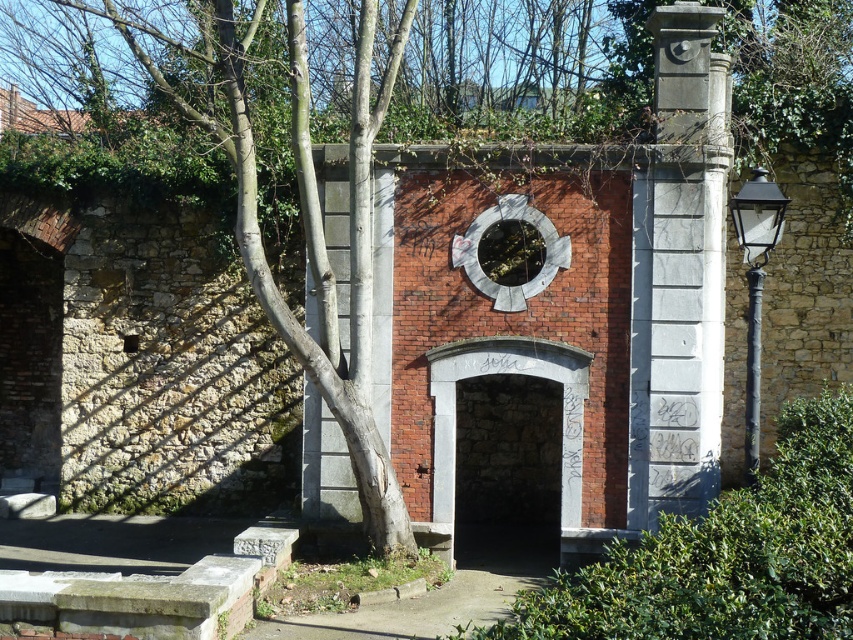
Question: Which of the following is the closest to the observer?

Choices:
 (A) (703, 305)
 (B) (503, 451)

Answer: (A)

Question: Does green leafy ivy at center appear on the left side of stone archway at center?

Choices:
 (A) no
 (B) yes

Answer: (A)

Question: Which object appears closest to the camera in this image?

Choices:
 (A) gray marble column at right
 (B) stone archway at center

Answer: (A)

Question: Does gray marble column at right appear over stone archway at center?

Choices:
 (A) no
 (B) yes

Answer: (B)

Question: Estimate the real-world distances between objects in this image. Which object is farther from the gray marble column at right?

Choices:
 (A) stone archway at center
 (B) green leafy ivy at center

Answer: (B)

Question: Does gray marble column at right appear under stone archway at center?

Choices:
 (A) yes
 (B) no

Answer: (B)